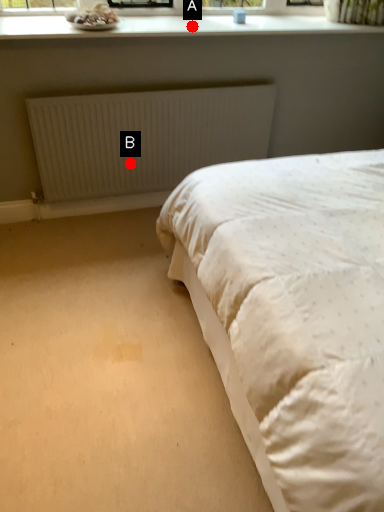
Question: Two points are circled on the image, labeled by A and B beside each circle. Among these points, which one is nearest to the camera?

Choices:
 (A) A is closer
 (B) B is closer

Answer: (A)